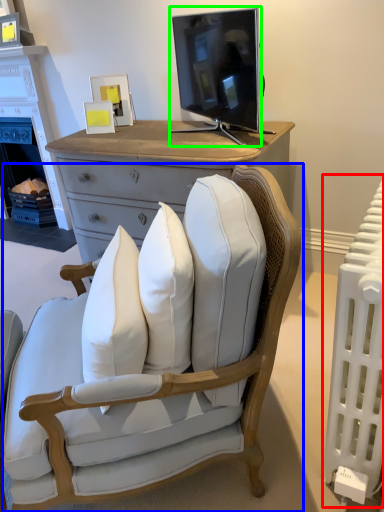
Question: Which is nearer to the radiator (highlighted by a red box)? chair (highlighted by a blue box) or television (highlighted by a green box).

Choices:
 (A) chair
 (B) television

Answer: (A)